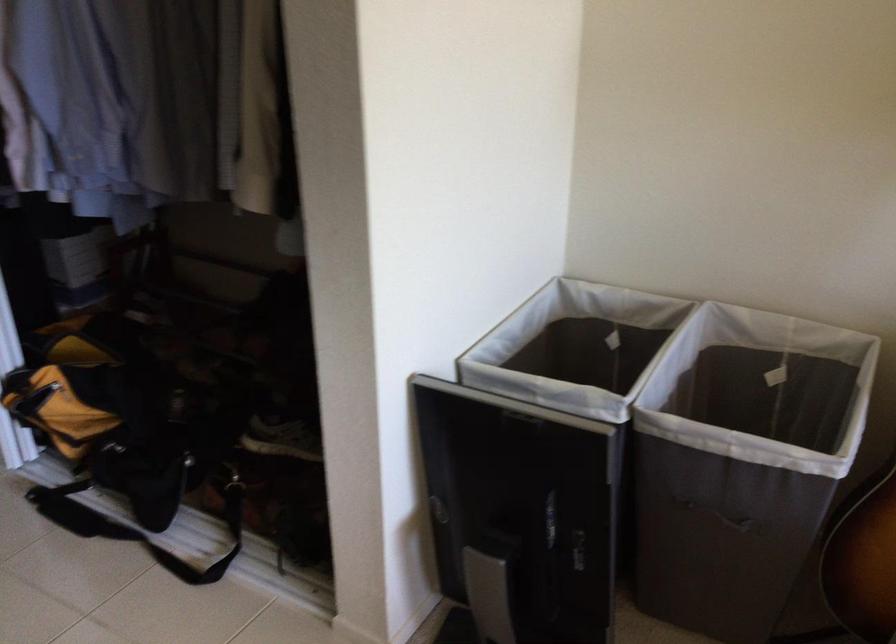
Describe the element at coordinates (719, 516) in the screenshot. I see `the laundry hamper handle` at that location.